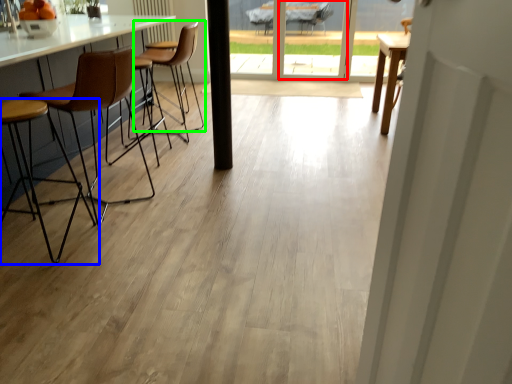
Question: Considering the real-world distances, which object is closest to screen door (highlighted by a red box)? chair (highlighted by a blue box) or chair (highlighted by a green box).

Choices:
 (A) chair
 (B) chair

Answer: (B)